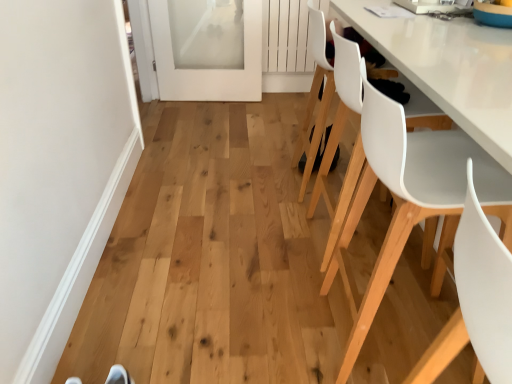
Question: Would you say white matte chair at lower right, which is counted as the 1th chair, starting from the front, is outside white plastic chair at right, which is the 3th chair in back-to-front order?

Choices:
 (A) no
 (B) yes

Answer: (B)

Question: Is white matte chair at lower right, which is counted as the 1th chair, starting from the front, bigger than white plastic chair at right, which is the 3th chair in back-to-front order?

Choices:
 (A) no
 (B) yes

Answer: (A)

Question: From a real-world perspective, is white matte chair at lower right, which is counted as the 1th chair, starting from the front, on white plastic chair at right, which ranks as the 2th chair in front-to-back order?

Choices:
 (A) no
 (B) yes

Answer: (B)

Question: Is white matte chair at lower right, which is counted as the 1th chair, starting from the front, shorter than white plastic chair at right, which ranks as the 2th chair in front-to-back order?

Choices:
 (A) no
 (B) yes

Answer: (B)

Question: From the image's perspective, would you say white matte chair at lower right, marked as the fourth chair in a back-to-front arrangement, is shown under white plastic chair at right, which ranks as the 2th chair in front-to-back order?

Choices:
 (A) no
 (B) yes

Answer: (B)

Question: Looking at their shapes, would you say white smooth door at left is wider or thinner than white plastic chair at right, which is the 3th chair in back-to-front order?

Choices:
 (A) thin
 (B) wide

Answer: (A)

Question: From a real-world perspective, is white smooth door at left physically located above or below white plastic chair at right, which is the 3th chair in back-to-front order?

Choices:
 (A) below
 (B) above

Answer: (A)

Question: Based on their positions, is white smooth door at left located to the left or right of white plastic chair at right, which ranks as the 2th chair in front-to-back order?

Choices:
 (A) left
 (B) right

Answer: (A)

Question: Considering the positions of white smooth door at left and white plastic chair at right, which ranks as the 2th chair in front-to-back order, in the image, is white smooth door at left bigger or smaller than white plastic chair at right, which ranks as the 2th chair in front-to-back order,?

Choices:
 (A) big
 (B) small

Answer: (B)

Question: Do you think white frosted glass door at upper left is within white smooth door at left, or outside of it?

Choices:
 (A) inside
 (B) outside

Answer: (B)

Question: Visually, is white frosted glass door at upper left positioned to the left or to the right of white smooth door at left?

Choices:
 (A) left
 (B) right

Answer: (B)

Question: From a real-world perspective, is white frosted glass door at upper left physically located above or below white smooth door at left?

Choices:
 (A) above
 (B) below

Answer: (A)

Question: Looking at their shapes, would you say white frosted glass door at upper left is wider or thinner than white smooth door at left?

Choices:
 (A) wide
 (B) thin

Answer: (A)

Question: From a real-world perspective, is white plastic chair at right, which is the 3th chair in back-to-front order, above or below white frosted glass door at upper left?

Choices:
 (A) below
 (B) above

Answer: (B)

Question: Considering the positions of white plastic chair at right, which ranks as the 2th chair in front-to-back order, and white frosted glass door at upper left in the image, is white plastic chair at right, which ranks as the 2th chair in front-to-back order, wider or thinner than white frosted glass door at upper left?

Choices:
 (A) wide
 (B) thin

Answer: (A)